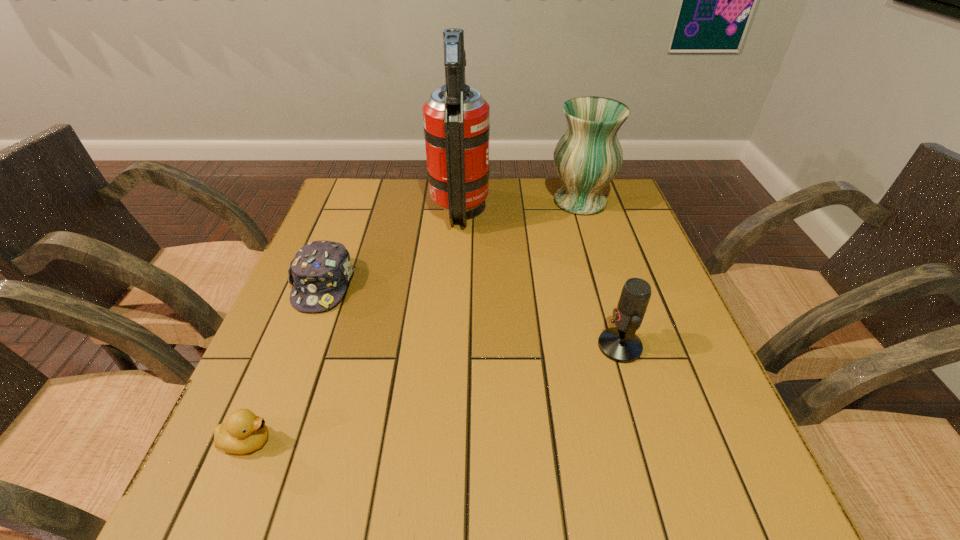
Where is `object situated at the far right corner`? This screenshot has width=960, height=540. object situated at the far right corner is located at coordinates click(588, 156).

What are the coordinates of `vacant space at the far edge` in the screenshot? It's located at (546, 183).

In the image, there is a desktop. Identify the location of vacant space at the near edge. The image size is (960, 540). (315, 514).

At what (x,y) coordinates should I click in order to perform the action: click on vacant space at the left edge of the desktop. Please return your answer as a coordinate pair (x, y). The width and height of the screenshot is (960, 540). Looking at the image, I should click on (282, 320).

Where is `free spot at the right edge of the desktop`? The image size is (960, 540). free spot at the right edge of the desktop is located at coordinates [613, 235].

Where is `vacant space at the far left corner`? vacant space at the far left corner is located at coordinates (371, 205).

The width and height of the screenshot is (960, 540). I want to click on free area in between the third farthest object and the nearest object, so [x=286, y=363].

What are the coordinates of `free space between the nearest object and the headwear` in the screenshot? It's located at (286, 363).

Locate an element on the screen. The image size is (960, 540). vacant space that's between the nearest object and the third nearest object is located at coordinates (286, 363).

Where is `vacant space that is in between the microphone and the nearest object`? vacant space that is in between the microphone and the nearest object is located at coordinates (434, 394).